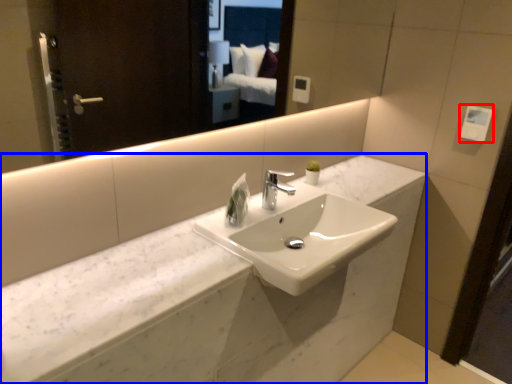
Question: Which object is further to the camera taking this photo, hand dryer (highlighted by a red box) or counter (highlighted by a blue box)?

Choices:
 (A) hand dryer
 (B) counter

Answer: (A)